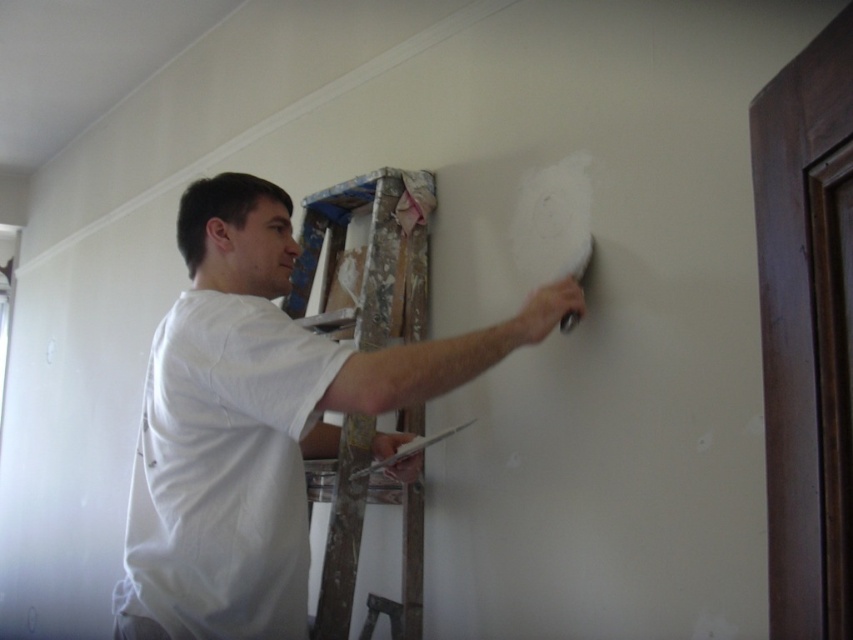
Question: Which object is the farthest from the wooden ladder at center?

Choices:
 (A) white matte t-shirt at center
 (B) white cotton shirt at center

Answer: (B)

Question: Does white matte t-shirt at center have a greater width compared to white cotton shirt at center?

Choices:
 (A) yes
 (B) no

Answer: (A)

Question: Among these objects, which one is farthest from the camera?

Choices:
 (A) white matte t-shirt at center
 (B) white cotton shirt at center
 (C) wooden ladder at center

Answer: (C)

Question: Estimate the real-world distances between objects in this image. Which object is closer to the wooden ladder at center?

Choices:
 (A) white matte t-shirt at center
 (B) white cotton shirt at center

Answer: (A)

Question: Can you confirm if white matte t-shirt at center is positioned to the right of wooden ladder at center?

Choices:
 (A) no
 (B) yes

Answer: (A)

Question: Does white matte t-shirt at center have a smaller size compared to white cotton shirt at center?

Choices:
 (A) no
 (B) yes

Answer: (A)